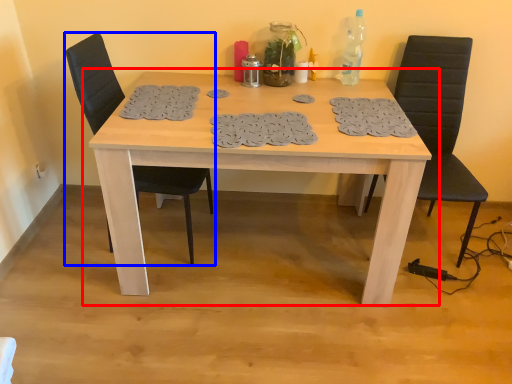
Question: Among these objects, which one is nearest to the camera, table (highlighted by a red box) or chair (highlighted by a blue box)?

Choices:
 (A) table
 (B) chair

Answer: (A)